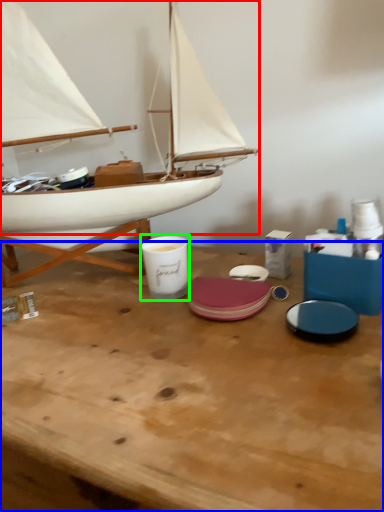
Question: Which object is positioned farthest from boat (highlighted by a red box)? Select from table (highlighted by a blue box) and tableware (highlighted by a green box).

Choices:
 (A) table
 (B) tableware

Answer: (A)